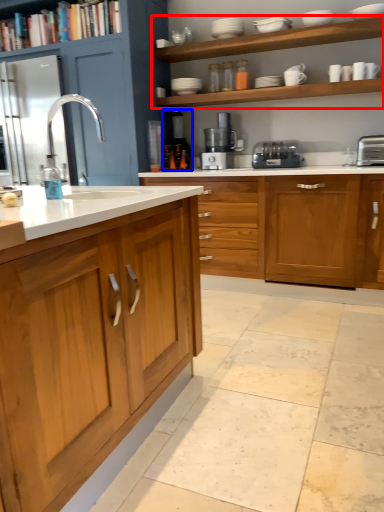
Question: Which object is further to the camera taking this photo, shelf (highlighted by a red box) or coffee machine (highlighted by a blue box)?

Choices:
 (A) shelf
 (B) coffee machine

Answer: (B)